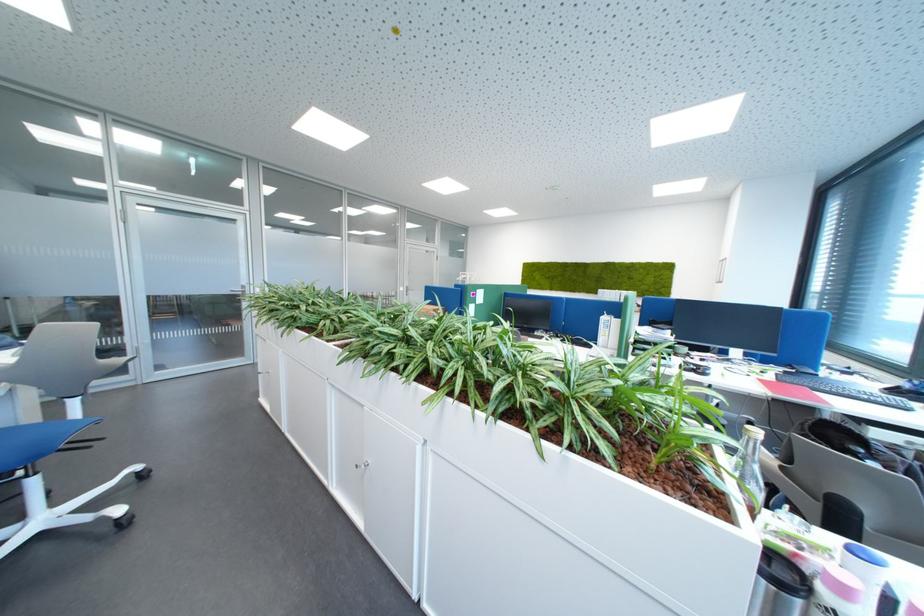
At what (x,y) coordinates should I click in order to perform the action: click on black computer keyboard. Please return your answer as a coordinate pair (x, y). Looking at the image, I should click on (844, 389).